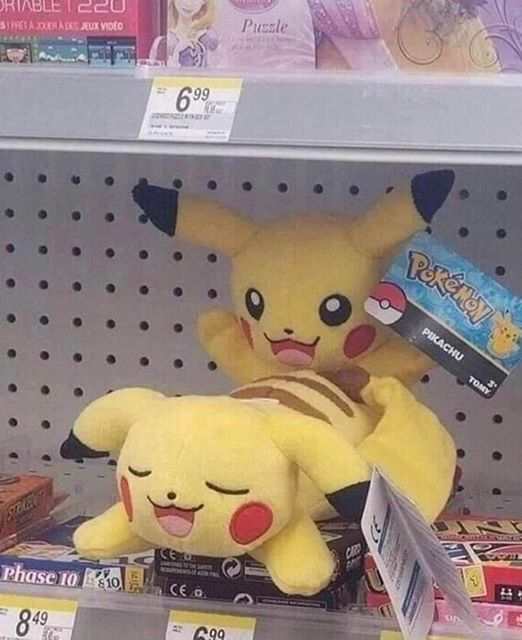
Locate an element on the screen. pegboard is located at coordinates (491, 429), (94, 306), (249, 182), (465, 214).